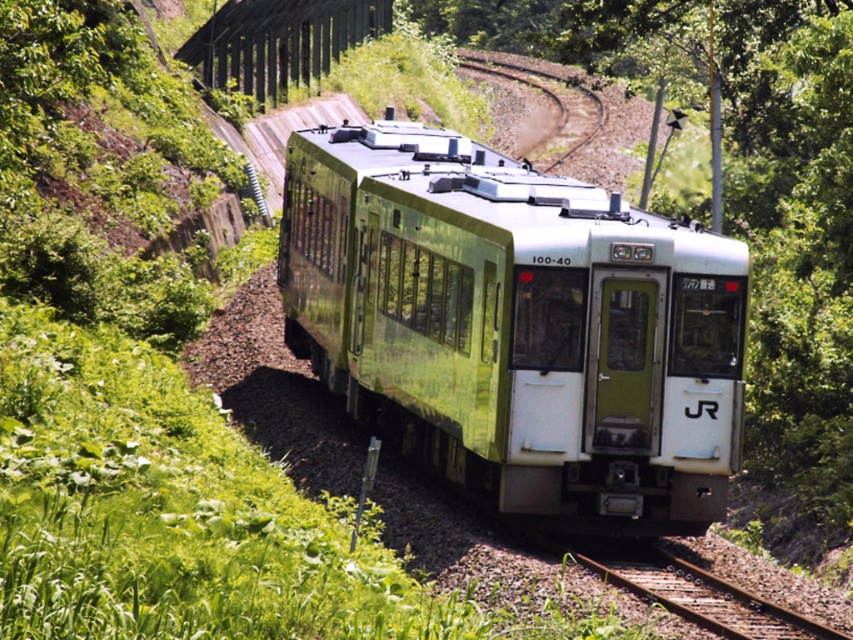
You are a passenger on the green metallic train at center and want to look out the window to see the green metallic track at center. Is the track visible from your current position?

The green metallic train at center is closer to the viewer than the green metallic track at center, so the track might be partially or fully obscured by the train itself from your perspective.

You are a railway inspector checking the tracks. You need to locate the rusty metal track at center. According to the coordinate system where the bottom left corner is the origin, what are its coordinates?

The rusty metal track at center is located at coordinates point (704, 596).

You are a railway inspector checking the safety of the tracks. You notice the green metallic train at center and the rusty metal track at center. Based on their widths, can the train safely pass through the track?

The green metallic train at center might be wider than rusty metal track at center, so there is a possibility that the train cannot safely pass through the track. Further measurements are needed to confirm.